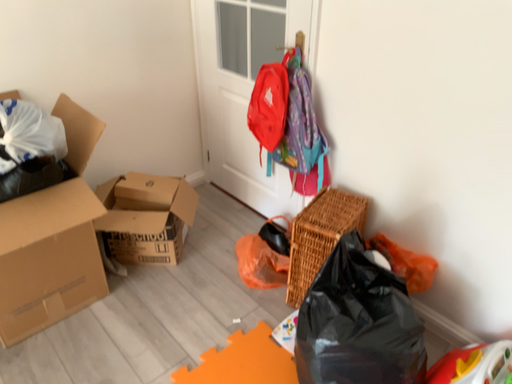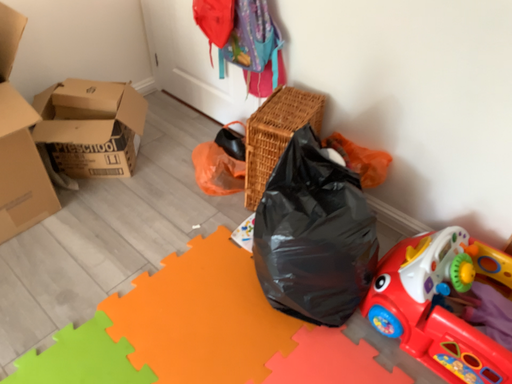
Question: How did the camera likely rotate when shooting the video?

Choices:
 (A) rotated downward
 (B) rotated upward

Answer: (A)